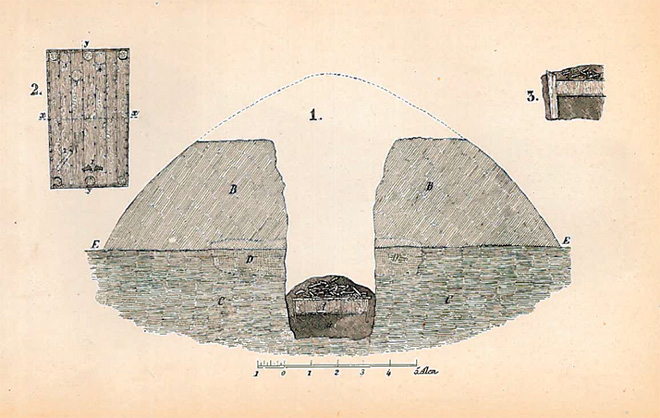
In order to click on brick wall in this screenshot , I will do `click(169, 293)`, `click(455, 302)`.